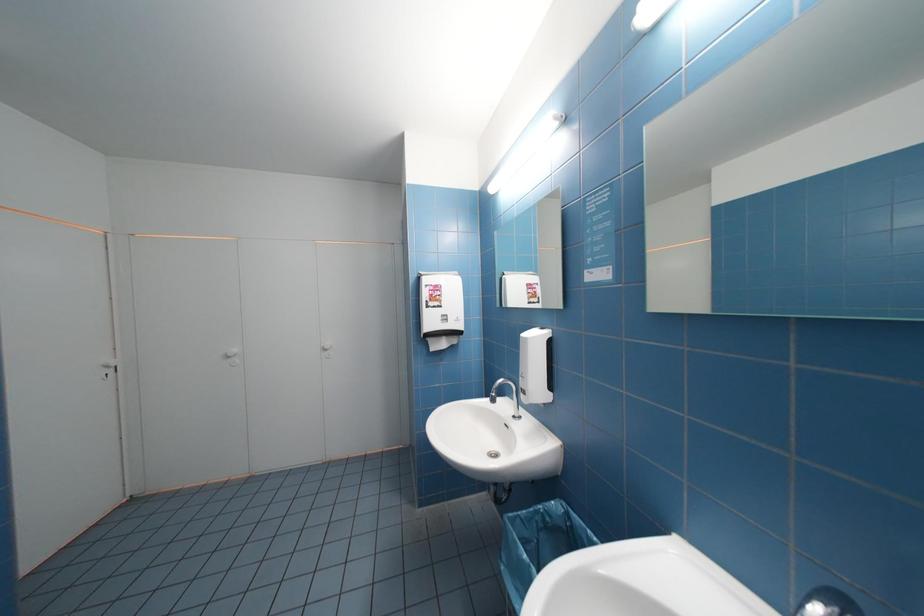
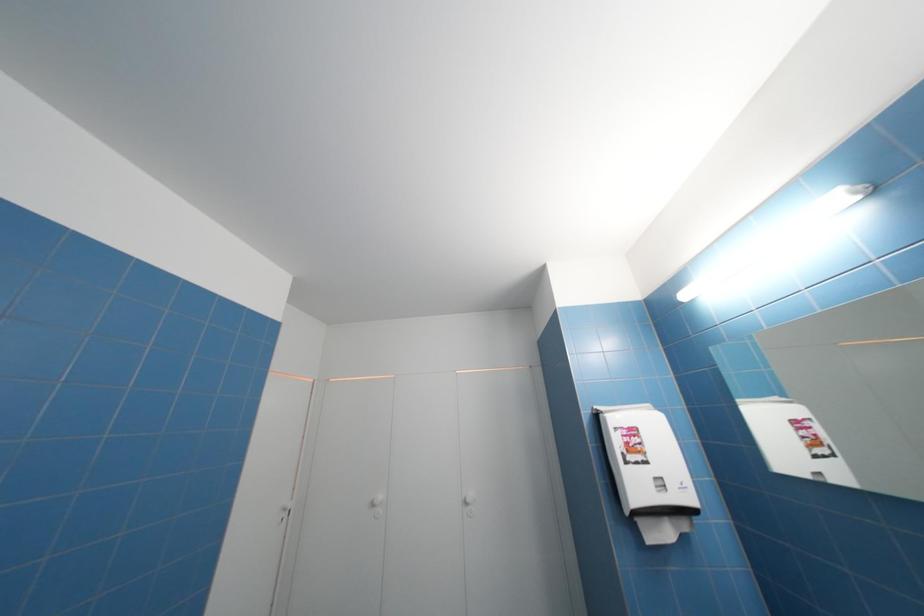
The first image is from the beginning of the video and the second image is from the end. How did the camera likely rotate when shooting the video?

The rotation direction of the camera is left-up.